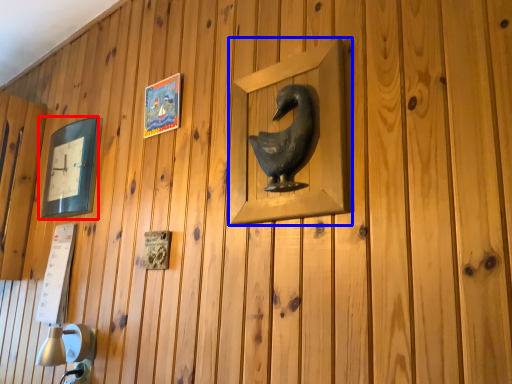
Question: Which of the following is the farthest to the observer, picture frame (highlighted by a red box) or picture frame (highlighted by a blue box)?

Choices:
 (A) picture frame
 (B) picture frame

Answer: (A)